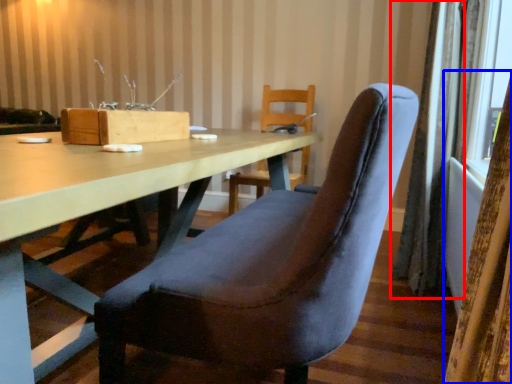
Question: Which of the following is the farthest to the observer, curtain (highlighted by a red box) or curtain (highlighted by a blue box)?

Choices:
 (A) curtain
 (B) curtain

Answer: (A)